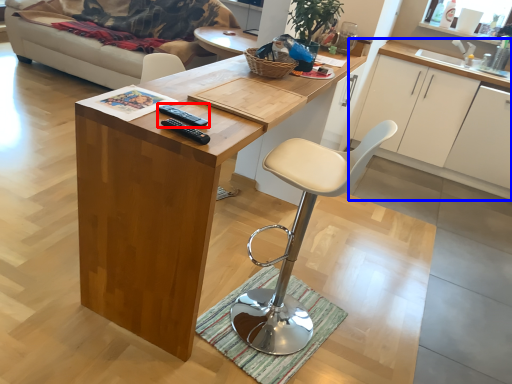
Question: Which object is further to the camera taking this photo, remote (highlighted by a red box) or cabinetry (highlighted by a blue box)?

Choices:
 (A) remote
 (B) cabinetry

Answer: (B)